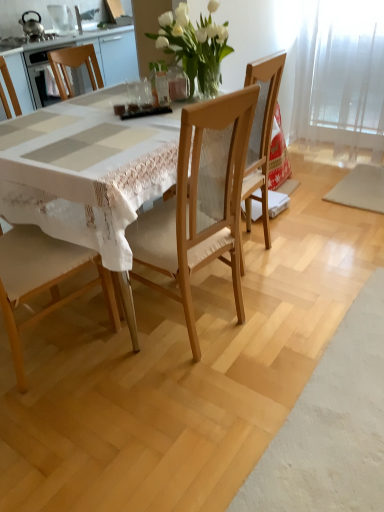
You are a GUI agent. You are given a task and a screenshot of the screen. Output one action in this format:
    pyautogui.click(x=<x>, y=<y>)
    Task: Click on the vacant space in front of clear glass at center
    Image resolution: width=384 pixels, height=512 pixels.
    Given the screenshot: What is the action you would take?
    tap(129, 112)